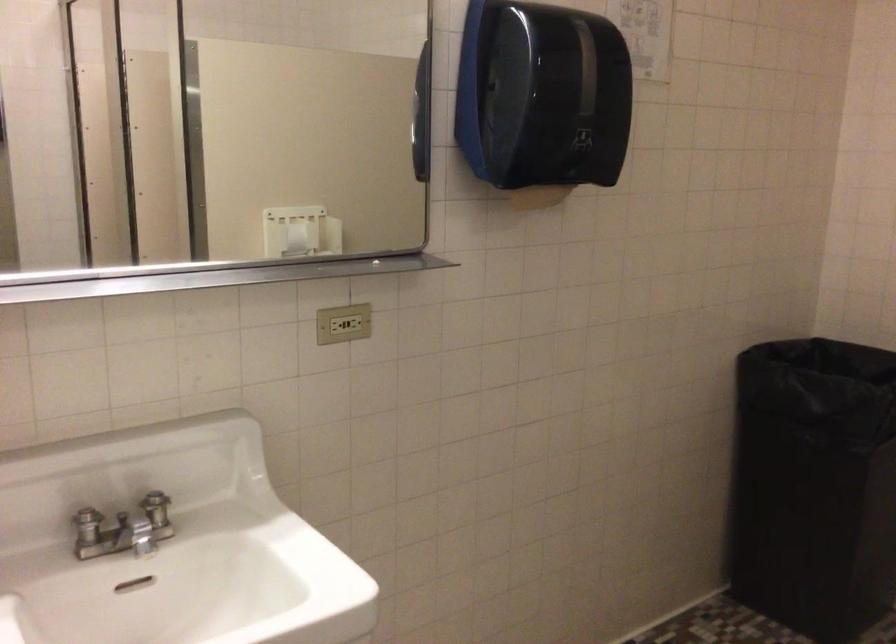
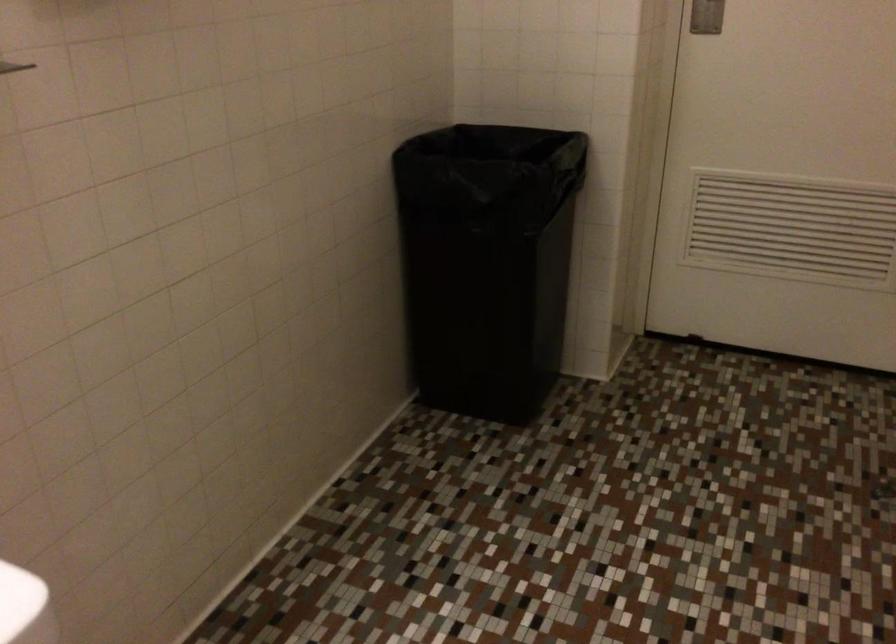
Question: How did the camera likely rotate?

Choices:
 (A) Left
 (B) Right
 (C) Up
 (D) Down

Answer: (B)